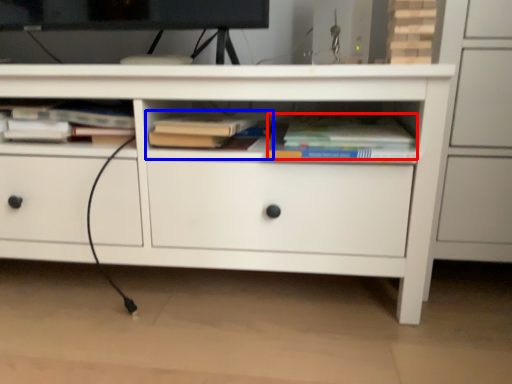
Question: Which of the following is the farthest to the observer, book (highlighted by a red box) or book (highlighted by a blue box)?

Choices:
 (A) book
 (B) book

Answer: (B)